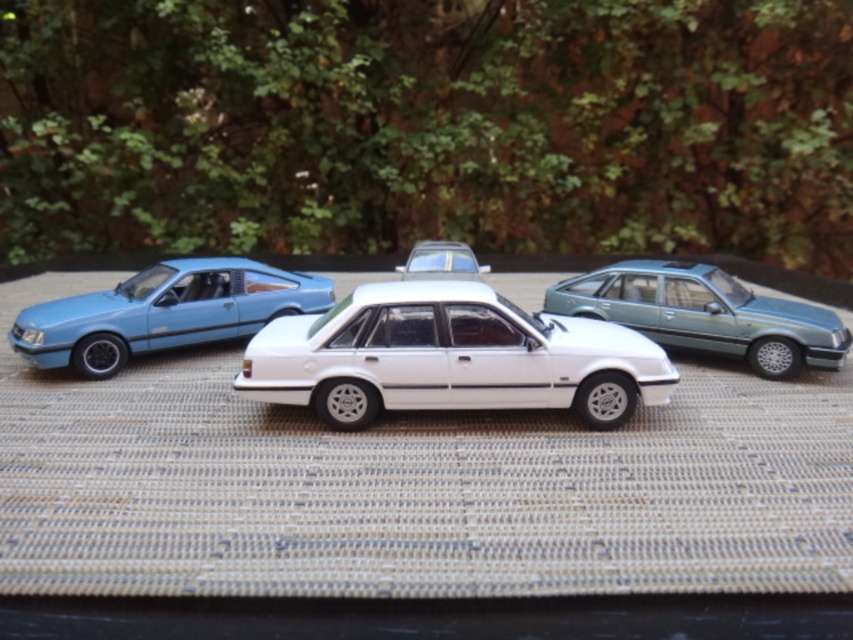
Which is in front, point (497, 394) or point (444, 241)?

Point (497, 394)

Can you confirm if white glossy sedan at center is positioned to the left of transparent plastic car at center?

No, white glossy sedan at center is not to the left of transparent plastic car at center.

Does point (662, 364) lie behind point (440, 269)?

No.

Where is `white glossy sedan at center`? white glossy sedan at center is located at coordinates (450, 356).

Is point (137, 310) farther from camera compared to point (653, 330)?

That is False.

Between point (175, 276) and point (708, 300), which one is positioned behind?

The point (175, 276) is more distant.

Who is more forward, (83, 307) or (646, 298)?

Point (83, 307) is in front.

What are the coordinates of `matte blue car at left` in the screenshot? It's located at (163, 312).

Which is more to the left, white glossy sedan at center or metallic teal sedan at right?

white glossy sedan at center

Who is taller, white glossy sedan at center or metallic teal sedan at right?

white glossy sedan at center

Identify the location of white glossy sedan at center. The width and height of the screenshot is (853, 640). (450, 356).

The image size is (853, 640). I want to click on white glossy sedan at center, so click(x=450, y=356).